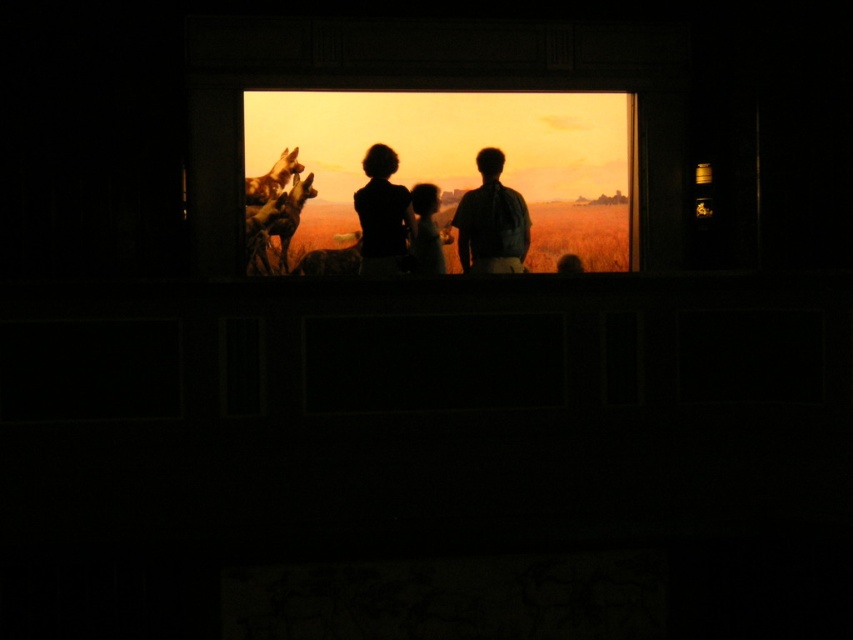
Is matte glass window at center further to camera compared to black matte shirt at center?

Yes, it is.

Who is more forward, [403,129] or [368,163]?

Point [368,163]

What are the coordinates of `matte glass window at center` in the screenshot? It's located at (447, 138).

Does point (521, 248) come behind point (358, 205)?

Yes, point (521, 248) is behind point (358, 205).

Which is below, dark green shirt at center or black matte shirt at center?

black matte shirt at center is below.

The height and width of the screenshot is (640, 853). Find the location of `dark green shirt at center`. dark green shirt at center is located at coordinates click(491, 221).

How distant is silhouette family at center from dark green shirt at center?

silhouette family at center and dark green shirt at center are 1.22 inches apart.

Who is lower down, silhouette family at center or dark green shirt at center?

dark green shirt at center is below.

At what (x,y) coordinates should I click in order to perform the action: click on silhouette family at center. Please return your answer as a coordinate pair (x, y). Looking at the image, I should click on (491, 221).

Identify the location of silhouette family at center. (491, 221).